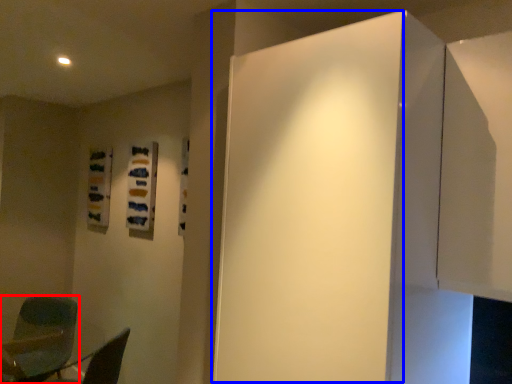
Question: Which of the following is the closest to the observer, chair (highlighted by a red box) or door (highlighted by a blue box)?

Choices:
 (A) chair
 (B) door

Answer: (B)